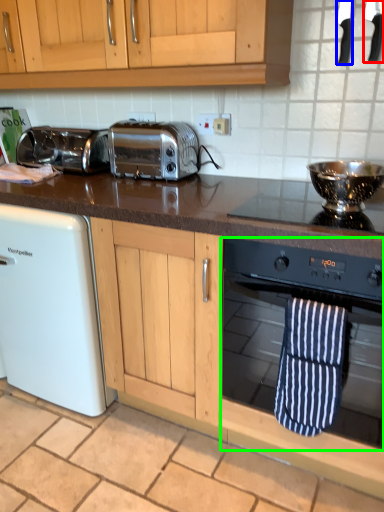
Question: Which is nearer to the appliance (highlighted by a red box)? appliance (highlighted by a blue box) or oven (highlighted by a green box).

Choices:
 (A) appliance
 (B) oven

Answer: (A)